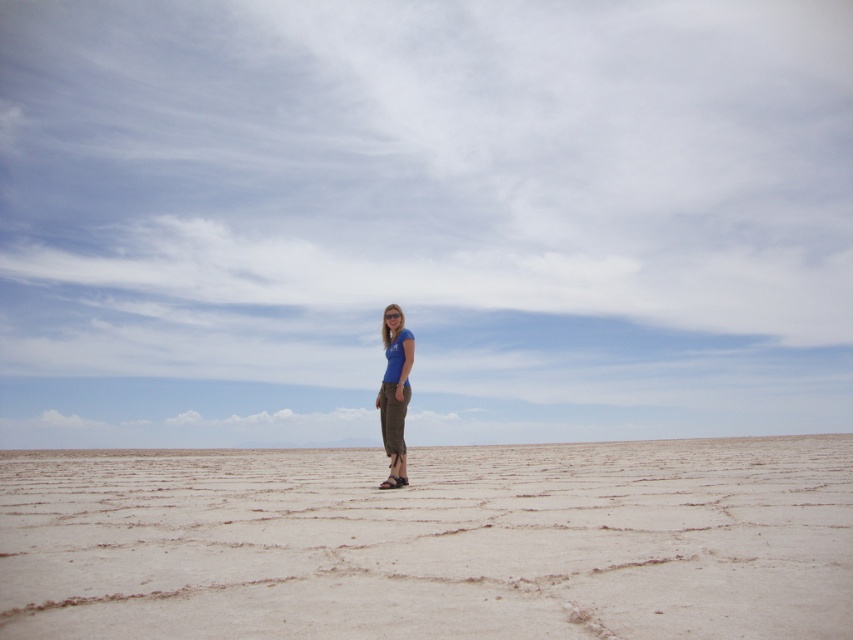
Question: Considering the relative positions of light brown sandy at center and blue fabric pants at center in the image provided, where is light brown sandy at center located with respect to blue fabric pants at center?

Choices:
 (A) above
 (B) below

Answer: (B)

Question: Can you confirm if light brown sandy at center is smaller than blue fabric pants at center?

Choices:
 (A) yes
 (B) no

Answer: (B)

Question: Does light brown sandy at center lie behind blue fabric pants at center?

Choices:
 (A) yes
 (B) no

Answer: (B)